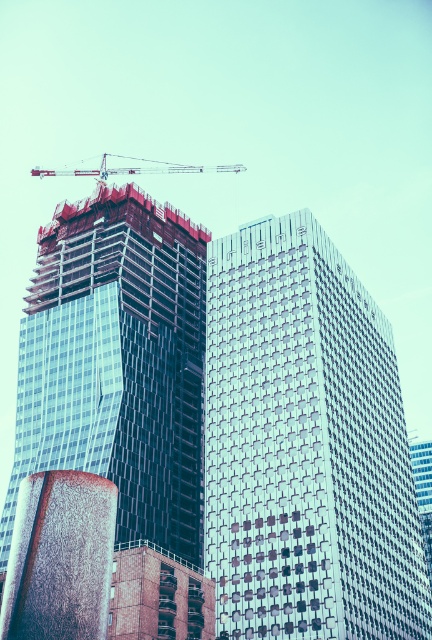
Question: Is glassy reflective building at center positioned behind glassy steel tower at center?

Choices:
 (A) yes
 (B) no

Answer: (B)

Question: Among these points, which one is nearest to the camera?

Choices:
 (A) (257, 387)
 (B) (85, 173)

Answer: (A)

Question: Considering the relative positions of glassy reflective building at center and glassy steel tower at center in the image provided, where is glassy reflective building at center located with respect to glassy steel tower at center?

Choices:
 (A) below
 (B) above

Answer: (A)

Question: Which object is the farthest from the glassy reflective building at center?

Choices:
 (A) glassy steel tower at center
 (B) white metallic crane at upper center

Answer: (B)

Question: Does glassy steel tower at center appear under white metallic crane at upper center?

Choices:
 (A) no
 (B) yes

Answer: (B)

Question: Among these points, which one is farthest from the camera?

Choices:
 (A) (186, 172)
 (B) (292, 486)

Answer: (A)